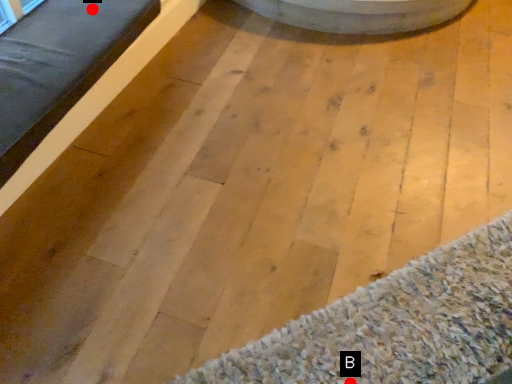
Question: Two points are circled on the image, labeled by A and B beside each circle. Among these points, which one is farthest from the camera?

Choices:
 (A) A is further
 (B) B is further

Answer: (A)